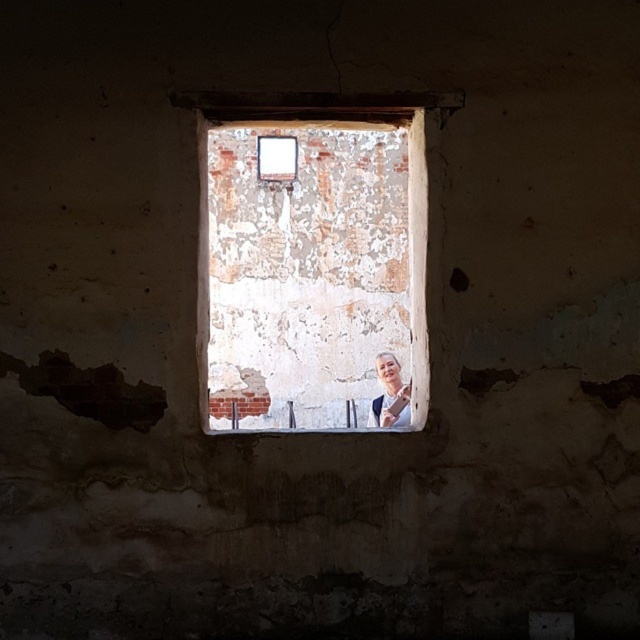
Question: Which of the following is the closest to the observer?

Choices:
 (A) white peeling paint at center
 (B) smooth beige woman at center

Answer: (A)

Question: Can you confirm if white peeling paint at center is positioned to the left of smooth beige woman at center?

Choices:
 (A) yes
 (B) no

Answer: (A)

Question: Considering the relative positions of white peeling paint at center and smooth beige woman at center in the image provided, where is white peeling paint at center located with respect to smooth beige woman at center?

Choices:
 (A) above
 (B) below

Answer: (A)

Question: Which of the following is the farthest from the observer?

Choices:
 (A) white peeling paint at center
 (B) smooth beige woman at center

Answer: (B)

Question: Does white peeling paint at center have a greater width compared to smooth beige woman at center?

Choices:
 (A) no
 (B) yes

Answer: (B)